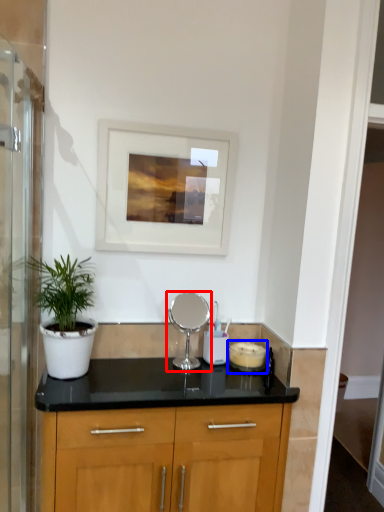
Question: Which point is further to the camera, appliance (highlighted by a red box) or appliance (highlighted by a blue box)?

Choices:
 (A) appliance
 (B) appliance

Answer: (B)